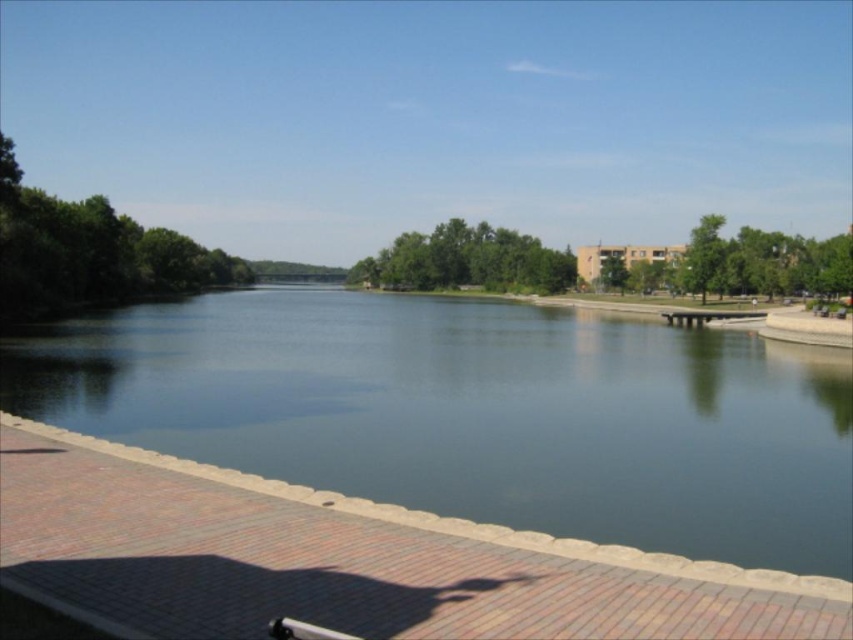
You are a tourist visiting the riverside and want to sit on the wooden park bench at center. However, you notice the green smooth water at center is directly below it. Is there a risk of getting your feet wet if you sit there?

The green smooth water at center is positioned under the wooden park bench at center, so sitting on the bench would place your feet near the water. There is a risk of getting your feet wet if the water level rises or if there are splashes.

You are standing on the paved brick pathway next to the river. You want to locate the green smooth water at center. In which direction should you look relative to your position?

The green smooth water at center is located at point coordinates (474, 413). Since you are on the paved brick pathway, which runs parallel to the river, you should look towards the center of the river to find the green smooth water at center.